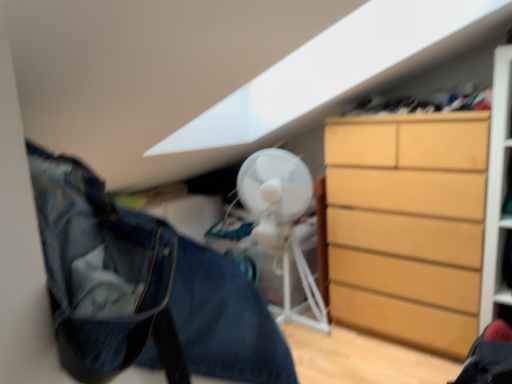
Question: From the image's perspective, relative to light brown wooden chest of drawers at right, is denim jacket at lower left above or below?

Choices:
 (A) above
 (B) below

Answer: (B)

Question: In terms of height, does denim jacket at lower left look taller or shorter compared to light brown wooden chest of drawers at right?

Choices:
 (A) short
 (B) tall

Answer: (A)

Question: Which object is positioned farthest from the white plastic mechanical fan at center?

Choices:
 (A) denim jacket at lower left
 (B) light brown wooden chest of drawers at right

Answer: (A)

Question: Considering the real-world distances, which object is closest to the denim jacket at lower left?

Choices:
 (A) white plastic mechanical fan at center
 (B) light brown wooden chest of drawers at right

Answer: (B)